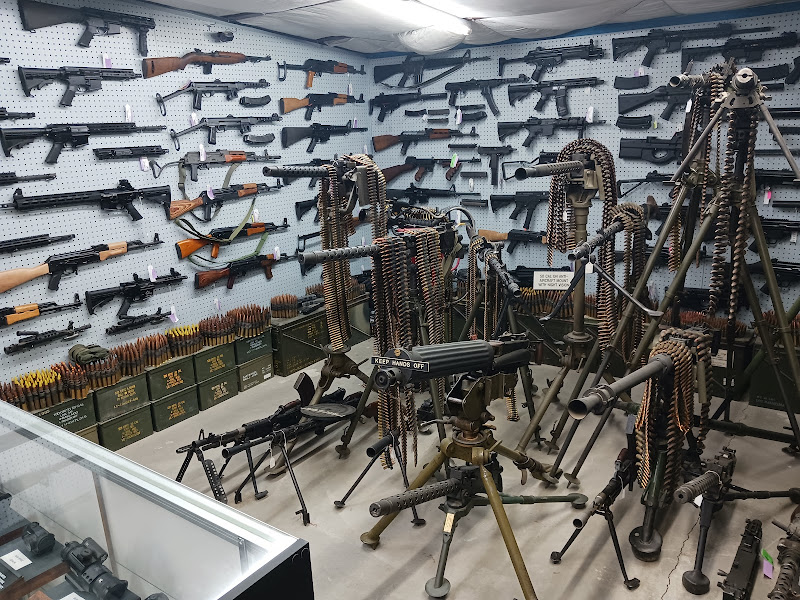
Image resolution: width=800 pixels, height=600 pixels. Find the location of `box`. box is located at coordinates (222, 394).